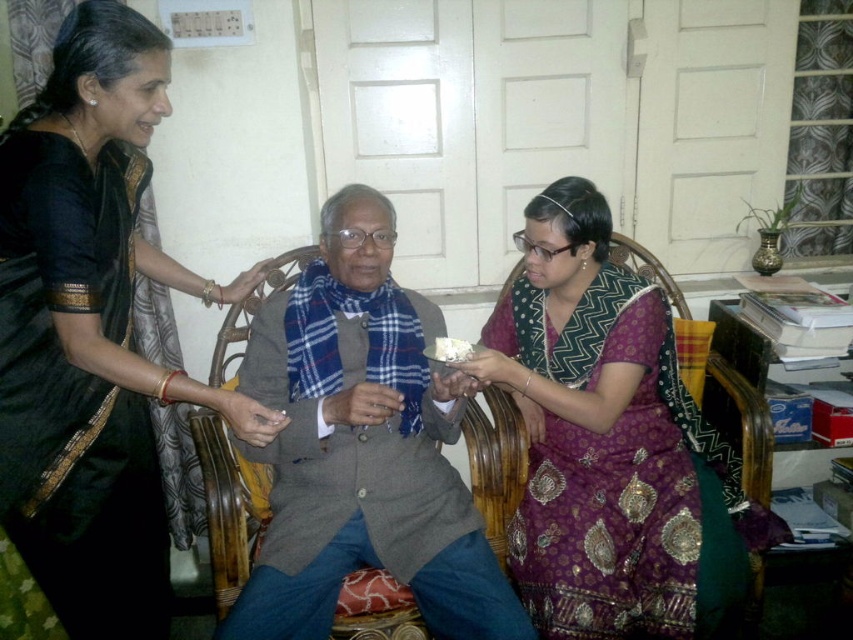
Who is positioned more to the left, purple brocade saree at center or wicker chair at center?

Positioned to the left is wicker chair at center.

Which is in front, point (492, 376) or point (236, 524)?

Point (236, 524)

You are a GUI agent. You are given a task and a screenshot of the screen. Output one action in this format:
    pyautogui.click(x=<x>, y=<y>)
    Task: Click on the purple brocade saree at center
    This screenshot has width=853, height=640.
    Given the screenshot: What is the action you would take?
    pyautogui.click(x=595, y=432)

Is black silk saree at upper left bigger than wicker chair at center?

Yes, black silk saree at upper left is bigger than wicker chair at center.

Does black silk saree at upper left have a greater height compared to wicker chair at center?

Indeed, black silk saree at upper left has a greater height compared to wicker chair at center.

Which is in front, point (129, 182) or point (347, 620)?

Point (347, 620) is more forward.

At what (x,y) coordinates should I click in order to perform the action: click on black silk saree at upper left. Please return your answer as a coordinate pair (x, y). This screenshot has height=640, width=853. Looking at the image, I should click on (91, 332).

Who is shorter, black silk saree at upper left or purple brocade saree at center?

purple brocade saree at center

Who is more forward, (7, 275) or (555, 333)?

Positioned in front is point (7, 275).

Image resolution: width=853 pixels, height=640 pixels. What are the coordinates of `black silk saree at upper left` in the screenshot? It's located at (91, 332).